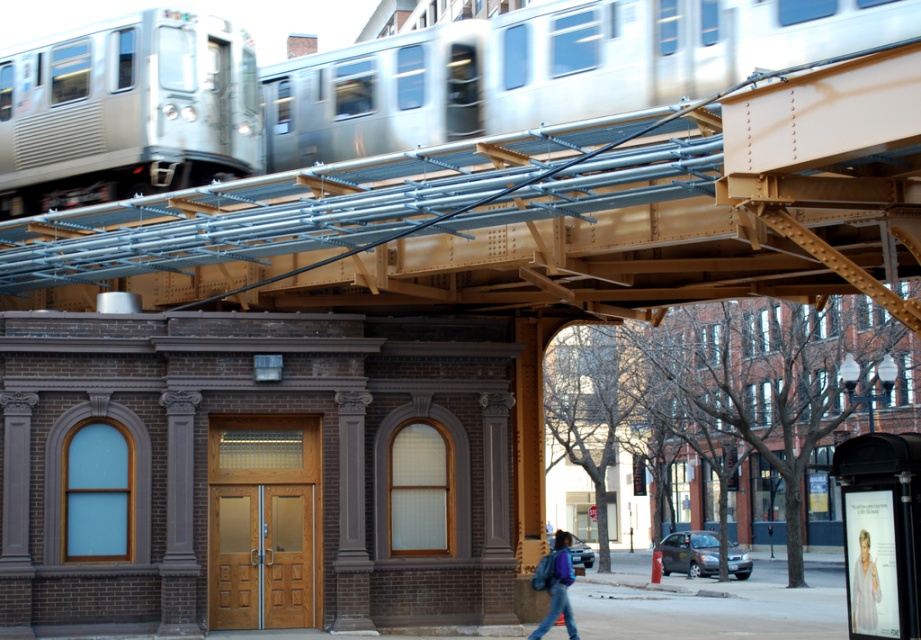
You are a delivery person carrying a blue fabric backpack at center and need to pass under the silver metallic train at upper left. Can you safely walk under the train without hitting your backpack?

The silver metallic train at upper left has a greater height compared to the blue fabric backpack at center, so you can safely walk under the train without hitting your backpack.

You are a delivery person standing on the sidewalk in front of the brick building. You need to place the blue fabric backpack at center on a shelf that can only hold items shorter than the silver metallic train at upper center. Will the backpack fit?

The silver metallic train at upper center has a greater height compared to the blue fabric backpack at center, so the backpack will fit on the shelf since it is shorter than the train.

You are an architect evaluating the urban space. You observe the silver metallic train at upper center and the silver metallic train at upper left. Which of the two trains appears shorter in height?

The silver metallic train at upper center is not as tall as the silver metallic train at upper left, so it appears shorter in height.